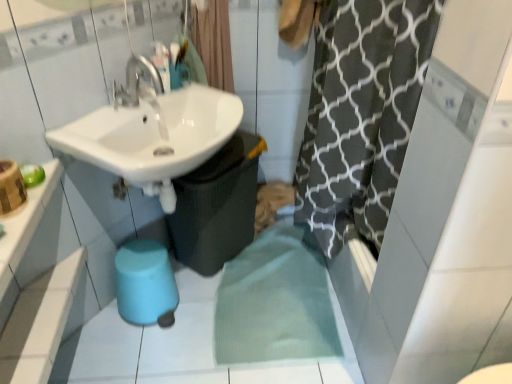
Image resolution: width=512 pixels, height=384 pixels. Describe the element at coordinates (214, 43) in the screenshot. I see `black textured shower curtain at upper center` at that location.

What is the approximate height of white glossy counter top at upper left?

It is 2.85 inches.

The image size is (512, 384). Identify the location of blue rubber bidet at lower center. (145, 284).

The height and width of the screenshot is (384, 512). I want to click on sink that appears below the white glossy counter top at upper left (from a real-world perspective), so click(152, 131).

Is white glossy counter top at upper left taller than white glossy sink at upper left?

Incorrect, the height of white glossy counter top at upper left is not larger of that of white glossy sink at upper left.

Would you say white glossy counter top at upper left contains white glossy sink at upper left?

No, white glossy counter top at upper left does not contain white glossy sink at upper left.

In the scene shown: From the image's perspective, is white glossy counter top at upper left over white glossy sink at upper left?

No.

Considering the relative sizes of white glossy counter top at upper left and blue rubber bidet at lower center in the image provided, is white glossy counter top at upper left taller than blue rubber bidet at lower center?

No, white glossy counter top at upper left is not taller than blue rubber bidet at lower center.

Can you confirm if white glossy counter top at upper left is positioned to the left of blue rubber bidet at lower center?

Yes.

Is white glossy counter top at upper left inside white glossy sink at upper left?

No, white glossy counter top at upper left is not surrounded by white glossy sink at upper left.

Relative to white glossy counter top at upper left, is white glossy sink at upper left in front or behind?

Clearly, white glossy sink at upper left is behind white glossy counter top at upper left.

At what (x,y) coordinates should I click in order to perform the action: click on sink behind the white glossy counter top at upper left. Please return your answer as a coordinate pair (x, y). Looking at the image, I should click on (152, 131).

From a real-world perspective, which object stands above the other?

From a 3D spatial view, white glossy counter top at upper left is above.

Does point (166, 187) lie in front of point (118, 301)?

Yes, point (166, 187) is in front of point (118, 301).

From a real-world perspective, is white glossy sink at upper left under blue rubber bidet at lower center?

No, from a real-world perspective, white glossy sink at upper left is not under blue rubber bidet at lower center.

Considering the sizes of objects white glossy sink at upper left and blue rubber bidet at lower center in the image provided, who is bigger, white glossy sink at upper left or blue rubber bidet at lower center?

white glossy sink at upper left is bigger.

This screenshot has height=384, width=512. In the image, there is a white glossy sink at upper left. What are the coordinates of `bidet below it (from a real-world perspective)` in the screenshot? It's located at (145, 284).

Is black textured shower curtain at upper center facing towards white glossy sink at upper left?

Yes, black textured shower curtain at upper center is aimed at white glossy sink at upper left.

Is black textured shower curtain at upper center with white glossy sink at upper left?

black textured shower curtain at upper center is not next to white glossy sink at upper left, and they're not touching.

Considering the points (208, 59) and (224, 105), which point is behind, point (208, 59) or point (224, 105)?

Point (208, 59)

Which is in front, point (126, 176) or point (217, 16)?

The point (126, 176) is closer to the camera.

How many degrees apart are the facing directions of white glossy sink at upper left and black textured shower curtain at upper center?

The angular difference between white glossy sink at upper left and black textured shower curtain at upper center is 55.7 degrees.

From a real-world perspective, is white glossy sink at upper left positioned over black textured shower curtain at upper center based on gravity?

No, from a real-world perspective, white glossy sink at upper left is not above black textured shower curtain at upper center.

Is white glossy sink at upper left bigger than black textured shower curtain at upper center?

Indeed, white glossy sink at upper left has a larger size compared to black textured shower curtain at upper center.

Which of these two, blue rubber bidet at lower center or black textured shower curtain at upper center, stands taller?

With more height is black textured shower curtain at upper center.

Considering the positions of points (148, 284) and (217, 57), is point (148, 284) closer to camera compared to point (217, 57)?

Yes.

Can you tell me how much blue rubber bidet at lower center and black textured shower curtain at upper center differ in facing direction?

The angle between the facing direction of blue rubber bidet at lower center and the facing direction of black textured shower curtain at upper center is 55.7 degrees.

Is blue rubber bidet at lower center in contact with black textured shower curtain at upper center?

blue rubber bidet at lower center and black textured shower curtain at upper center are not in contact.

Locate an element on the screen. counter top in front of the white glossy sink at upper left is located at coordinates (27, 218).

Identify the location of bidet below the white glossy counter top at upper left (from the image's perspective). The height and width of the screenshot is (384, 512). (145, 284).

Consider the image. Considering their positions, is black textured shower curtain at upper center positioned closer to white glossy counter top at upper left than blue rubber bidet at lower center?

blue rubber bidet at lower center.

Considering their positions, is white glossy counter top at upper left positioned further to blue rubber bidet at lower center than white glossy sink at upper left?

The object further to blue rubber bidet at lower center is white glossy counter top at upper left.

Estimate the real-world distances between objects in this image. Which object is further from white glossy counter top at upper left, blue rubber bidet at lower center or black textured shower curtain at upper center?

black textured shower curtain at upper center is positioned further to the anchor white glossy counter top at upper left.

From the image, which object appears to be nearer to white glossy sink at upper left, black textured shower curtain at upper center or white glossy counter top at upper left?

The object closer to white glossy sink at upper left is white glossy counter top at upper left.

Based on their spatial positions, is white glossy sink at upper left or white glossy counter top at upper left further from black textured shower curtain at upper center?

white glossy counter top at upper left lies further to black textured shower curtain at upper center than the other object.

Which object lies nearer to the anchor point white glossy counter top at upper left, blue rubber bidet at lower center or white glossy sink at upper left?

Among the two, white glossy sink at upper left is located nearer to white glossy counter top at upper left.

From the image, which object appears to be nearer to white glossy counter top at upper left, black textured shower curtain at upper center or white glossy sink at upper left?

The object closer to white glossy counter top at upper left is white glossy sink at upper left.

Estimate the real-world distances between objects in this image. Which object is further from blue rubber bidet at lower center, black textured shower curtain at upper center or white glossy sink at upper left?

black textured shower curtain at upper center is positioned further to the anchor blue rubber bidet at lower center.

Where is `sink between black textured shower curtain at upper center and blue rubber bidet at lower center vertically`? This screenshot has height=384, width=512. sink between black textured shower curtain at upper center and blue rubber bidet at lower center vertically is located at coordinates pos(152,131).

The height and width of the screenshot is (384, 512). What are the coordinates of `counter top between black textured shower curtain at upper center and blue rubber bidet at lower center vertically` in the screenshot? It's located at (27, 218).

Find the location of `sink between black textured shower curtain at upper center and white glossy counter top at upper left in the up-down direction`. sink between black textured shower curtain at upper center and white glossy counter top at upper left in the up-down direction is located at coordinates (152, 131).

You are a GUI agent. You are given a task and a screenshot of the screen. Output one action in this format:
    pyautogui.click(x=<x>, y=<y>)
    Task: Click on the sink positioned between white glossy counter top at upper left and blue rubber bidet at lower center from near to far
    
    Given the screenshot: What is the action you would take?
    pyautogui.click(x=152, y=131)